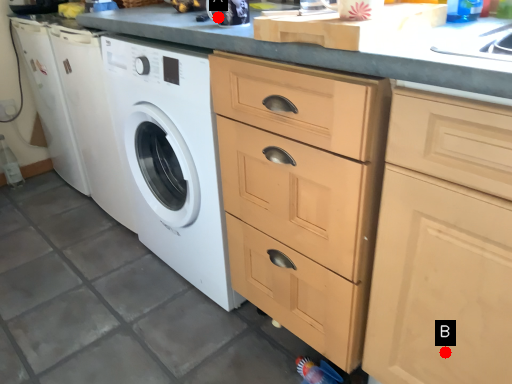
Question: Two points are circled on the image, labeled by A and B beside each circle. Which point is closer to the camera taking this photo?

Choices:
 (A) A is closer
 (B) B is closer

Answer: (B)